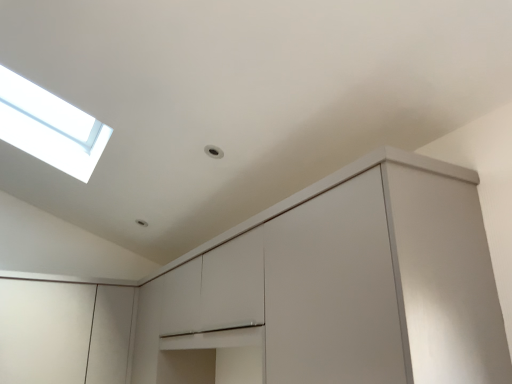
Question: From a real-world perspective, is matte white cabinet at center, which appears as the second cabinetry when viewed from the left, below white matte cabinet at lower left, the second cabinetry positioned from the right?

Choices:
 (A) yes
 (B) no

Answer: (B)

Question: Does matte white cabinet at center, which appears as the second cabinetry when viewed from the left, have a lesser width compared to white matte cabinet at lower left, which is the first cabinetry from left to right?

Choices:
 (A) no
 (B) yes

Answer: (B)

Question: From the image's perspective, is matte white cabinet at center, which is the 1th cabinetry in right-to-left order, below white matte cabinet at lower left, the second cabinetry positioned from the right?

Choices:
 (A) no
 (B) yes

Answer: (A)

Question: Is white matte cabinet at lower left, which is the first cabinetry from left to right, a part of matte white cabinet at center, which appears as the second cabinetry when viewed from the left?

Choices:
 (A) yes
 (B) no

Answer: (B)

Question: Is matte white cabinet at center, which is the 1th cabinetry in right-to-left order, positioned with its back to white matte cabinet at lower left, the second cabinetry positioned from the right?

Choices:
 (A) yes
 (B) no

Answer: (B)

Question: Does matte white cabinet at center, which appears as the second cabinetry when viewed from the left, turn towards white matte cabinet at lower left, the second cabinetry positioned from the right?

Choices:
 (A) no
 (B) yes

Answer: (B)

Question: Is white matte cabinet at lower left, the second cabinetry positioned from the right, positioned far away from matte white cabinet at center, which is the 1th cabinetry in right-to-left order?

Choices:
 (A) yes
 (B) no

Answer: (A)

Question: Can matte white cabinet at center, which appears as the second cabinetry when viewed from the left, be found inside white matte cabinet at lower left, the second cabinetry positioned from the right?

Choices:
 (A) yes
 (B) no

Answer: (B)

Question: Is white matte cabinet at lower left, the second cabinetry positioned from the right, taller than matte white cabinet at center, which is the 1th cabinetry in right-to-left order?

Choices:
 (A) no
 (B) yes

Answer: (A)

Question: Is white matte cabinet at lower left, which is the first cabinetry from left to right, outside matte white cabinet at center, which appears as the second cabinetry when viewed from the left?

Choices:
 (A) yes
 (B) no

Answer: (A)

Question: Can you confirm if white matte cabinet at lower left, the second cabinetry positioned from the right, is wider than matte white cabinet at center, which is the 1th cabinetry in right-to-left order?

Choices:
 (A) yes
 (B) no

Answer: (A)

Question: Is the depth of white matte cabinet at lower left, the second cabinetry positioned from the right, less than that of matte white cabinet at center, which is the 1th cabinetry in right-to-left order?

Choices:
 (A) no
 (B) yes

Answer: (A)

Question: From the image's perspective, is matte white cabinet at center, which is the 1th cabinetry in right-to-left order, positioned above or below white matte cabinet at lower left, which is the first cabinetry from left to right?

Choices:
 (A) above
 (B) below

Answer: (A)